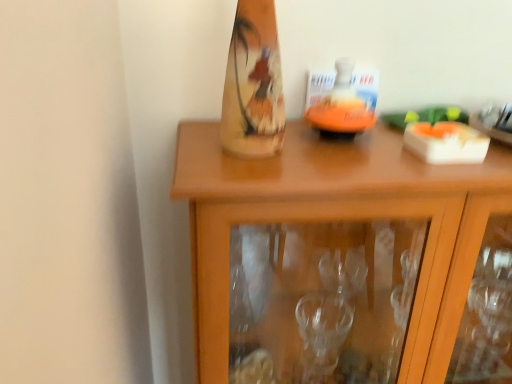
At what (x,y) coordinates should I click in order to perform the action: click on free space in front of orange matte candle holder at center. Please return your answer as a coordinate pair (x, y). The height and width of the screenshot is (384, 512). Looking at the image, I should click on (349, 164).